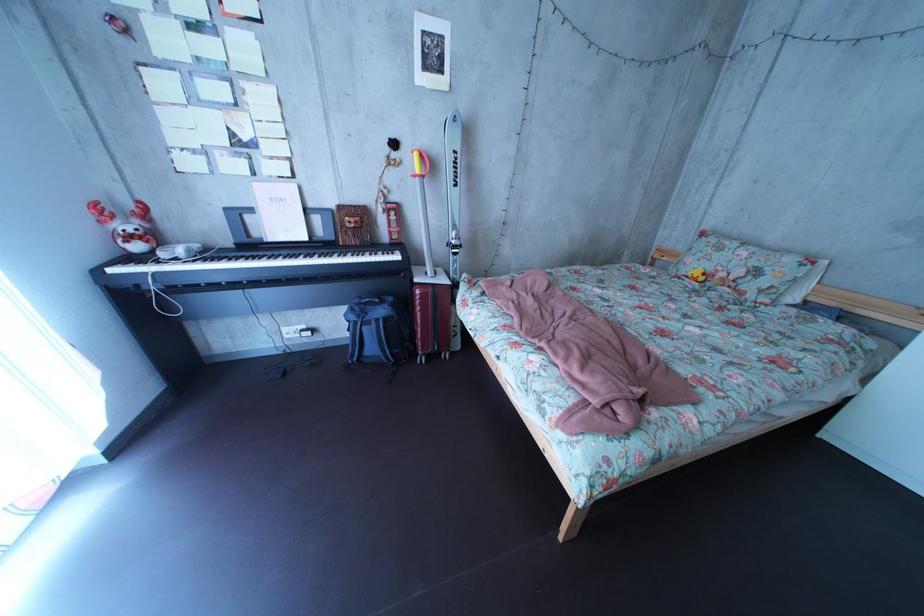
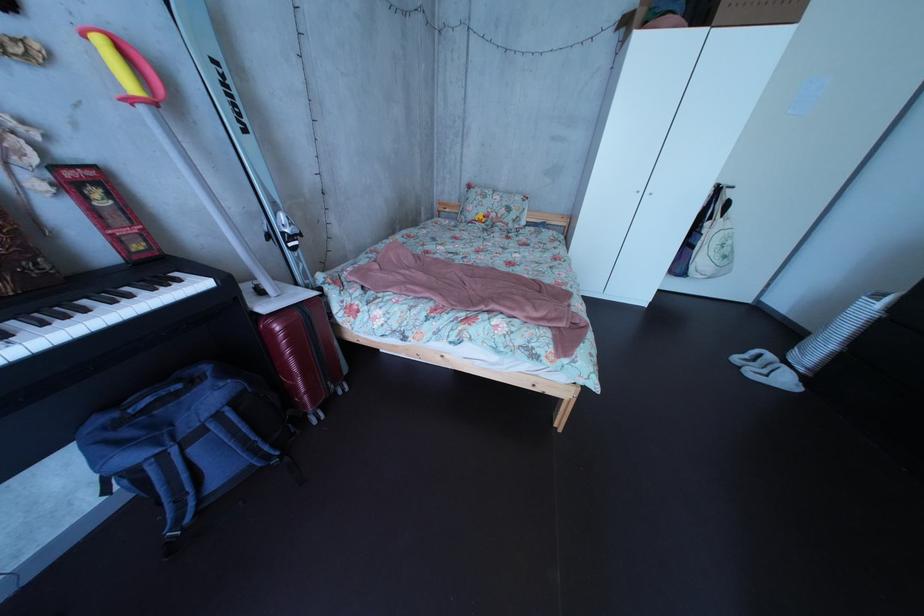
First-person continuous shooting, in which direction is the camera rotating?

The camera's rotation is toward right-down.